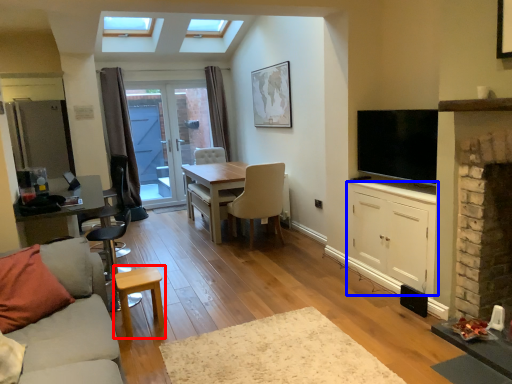
Question: Which object is further to the camera taking this photo, stool (highlighted by a red box) or cabinetry (highlighted by a blue box)?

Choices:
 (A) stool
 (B) cabinetry

Answer: (B)